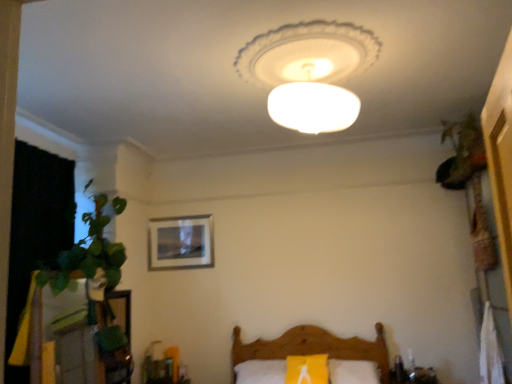
Question: Can you see white frosted glass lampshade at center touching green leafy plant at upper right?

Choices:
 (A) no
 (B) yes

Answer: (A)

Question: Is white frosted glass lampshade at center bigger than green leafy plant at upper right?

Choices:
 (A) no
 (B) yes

Answer: (B)

Question: Considering the relative positions of white frosted glass lampshade at center and green leafy plant at upper right in the image provided, is white frosted glass lampshade at center in front of green leafy plant at upper right?

Choices:
 (A) yes
 (B) no

Answer: (A)

Question: Is white frosted glass lampshade at center further to the viewer compared to green leafy plant at upper right?

Choices:
 (A) yes
 (B) no

Answer: (B)

Question: From the image's perspective, is white frosted glass lampshade at center located above green leafy plant at upper right?

Choices:
 (A) yes
 (B) no

Answer: (A)

Question: Is white frosted glass lampshade at center wider than green leafy plant at upper right?

Choices:
 (A) no
 (B) yes

Answer: (B)

Question: Is green leafy plant at upper right beside white frosted glass lampshade at center?

Choices:
 (A) no
 (B) yes

Answer: (A)

Question: Does green leafy plant at upper right have a smaller size compared to white frosted glass lampshade at center?

Choices:
 (A) yes
 (B) no

Answer: (A)

Question: Is green leafy plant at upper right taller than white frosted glass lampshade at center?

Choices:
 (A) no
 (B) yes

Answer: (B)

Question: From the image's perspective, would you say green leafy plant at upper right is shown under white frosted glass lampshade at center?

Choices:
 (A) yes
 (B) no

Answer: (A)

Question: Can you confirm if green leafy plant at upper right is shorter than white frosted glass lampshade at center?

Choices:
 (A) no
 (B) yes

Answer: (A)

Question: Can white frosted glass lampshade at center be found inside green leafy plant at upper right?

Choices:
 (A) yes
 (B) no

Answer: (B)

Question: Considering the relative sizes of white frosted glass lampshade at center and wooden bed at lower center in the image provided, is white frosted glass lampshade at center wider than wooden bed at lower center?

Choices:
 (A) yes
 (B) no

Answer: (B)